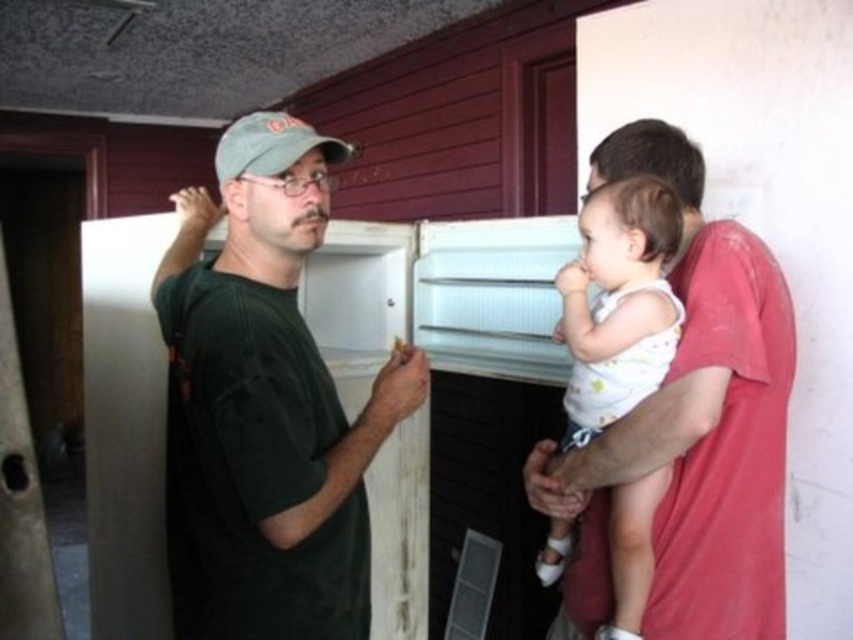
Question: Which point is closer to the camera?

Choices:
 (A) (198, 634)
 (B) (222, 134)
 (C) (656, 246)

Answer: (A)

Question: Which of the following is the closest to the observer?

Choices:
 (A) dark green t-shirt at left
 (B) green fabric baseball cap at upper center

Answer: (A)

Question: Can you confirm if white cotton baby at center is wider than green fabric baseball cap at upper center?

Choices:
 (A) no
 (B) yes

Answer: (B)

Question: Where is matte red shirt at right located in relation to green fabric baseball cap at upper center in the image?

Choices:
 (A) above
 (B) below

Answer: (B)

Question: Which object is closer to the camera taking this photo?

Choices:
 (A) dark green t-shirt at left
 (B) white cotton baby at center

Answer: (A)

Question: Is matte red shirt at right further to camera compared to green fabric baseball cap at upper center?

Choices:
 (A) no
 (B) yes

Answer: (A)